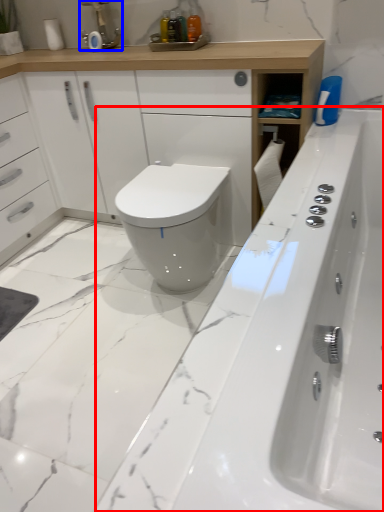
Question: Among these objects, which one is farthest to the camera, bath (highlighted by a red box) or faucet (highlighted by a blue box)?

Choices:
 (A) bath
 (B) faucet

Answer: (B)